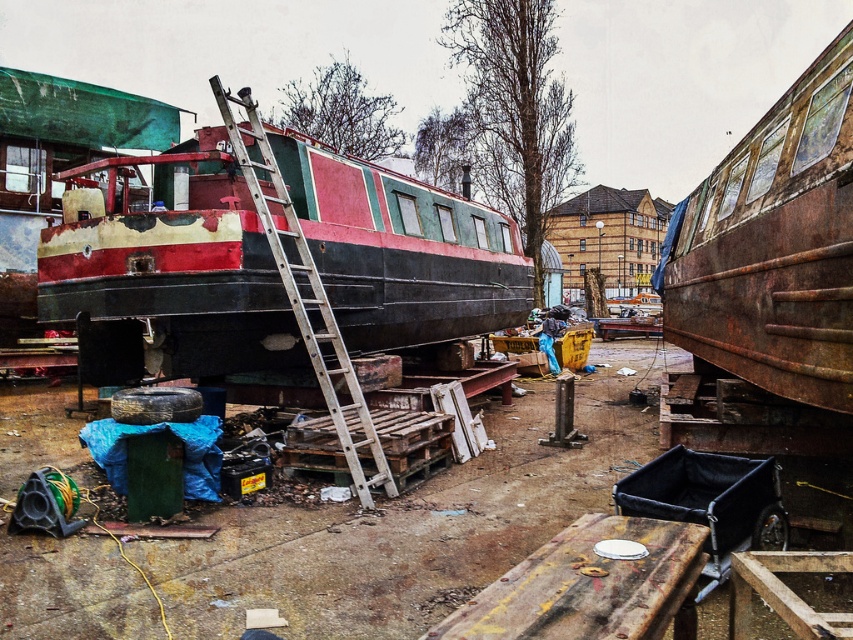
What do you see at coordinates (167, 272) in the screenshot? The height and width of the screenshot is (640, 853). I see `rusty metal boat at center` at bounding box center [167, 272].

Between rusty metal boat at center and wooden at left, which one is positioned higher?

rusty metal boat at center is higher up.

At what (x,y) coordinates should I click in order to perform the action: click on rusty metal boat at center. Please return your answer as a coordinate pair (x, y). This screenshot has height=640, width=853. Looking at the image, I should click on (167, 272).

At what (x,y) coordinates should I click in order to perform the action: click on rusty metal dock at lower center. Please return your answer as a coordinate pair (x, y). Looking at the image, I should click on (587, 586).

Who is more forward, (567, 580) or (283, 184)?

Point (567, 580) is in front.

Describe the element at coordinates (587, 586) in the screenshot. I see `rusty metal dock at lower center` at that location.

Locate an element on the screen. This screenshot has height=640, width=853. rusty metal dock at lower center is located at coordinates (587, 586).

Is rusty metal boat at center closer to camera compared to rusty metal train car at right?

No, it is behind rusty metal train car at right.

Is rusty metal boat at center thinner than rusty metal train car at right?

Correct, rusty metal boat at center's width is less than rusty metal train car at right's.

Between point (125, 376) and point (753, 342), which one is positioned behind?

Point (125, 376)

Locate an element on the screen. This screenshot has height=640, width=853. rusty metal boat at center is located at coordinates (167, 272).